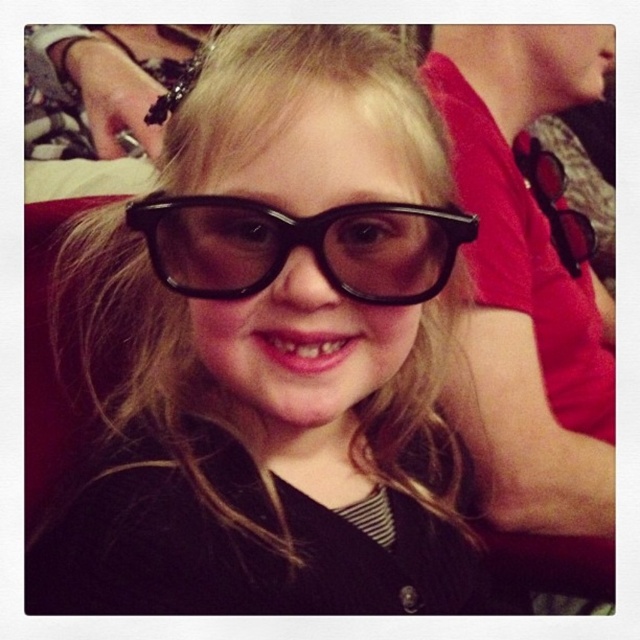
The girl is wearing two pairs of glasses. The black plastic glasses at center and the black glossy glasses at center. Which pair of glasses is wider?

The black plastic glasses at center is wider than the black glossy glasses at center.

In the image, there are two pairs of glasses at the center of the scene. The first pair is labeled as black plastic glasses at center, and the second is black glossy glasses at center. From the perspective of someone facing the girl, which pair is located to the left?

The black plastic glasses at center is positioned on the left side of black glossy glasses at center, so from the perspective of someone facing the girl, the black plastic glasses at center is on the left.

The girl is wearing two pairs of glasses. Which pair, the black plastic glasses at center or the black glossy glasses at center, is larger in size?

The black plastic glasses at center is bigger than black glossy glasses at center.